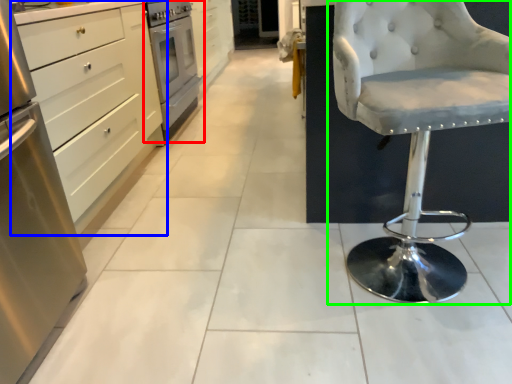
Question: Which is nearer to the home appliance (highlighted by a red box)? cabinetry (highlighted by a blue box) or chair (highlighted by a green box).

Choices:
 (A) cabinetry
 (B) chair

Answer: (A)